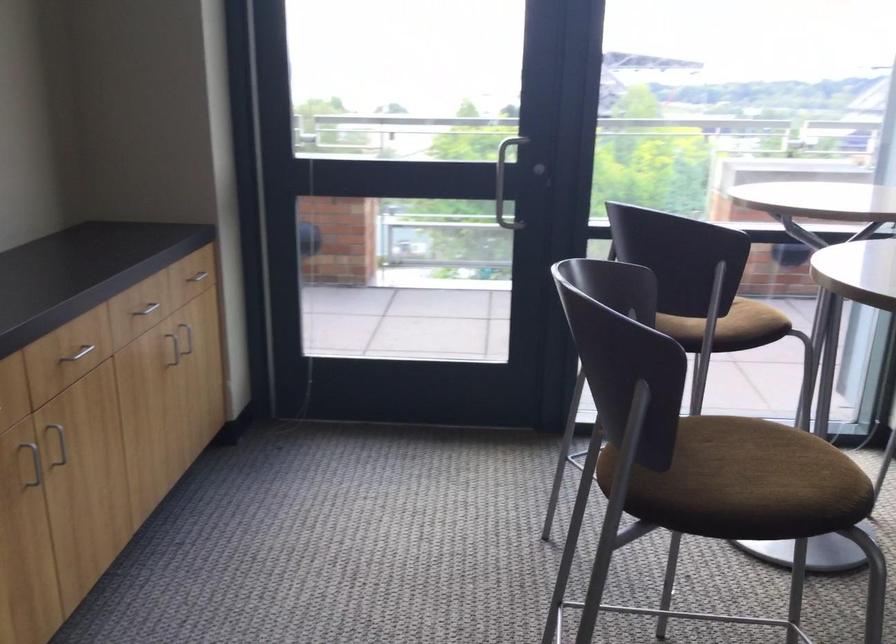
This screenshot has height=644, width=896. I want to click on metal door handle, so click(503, 173).